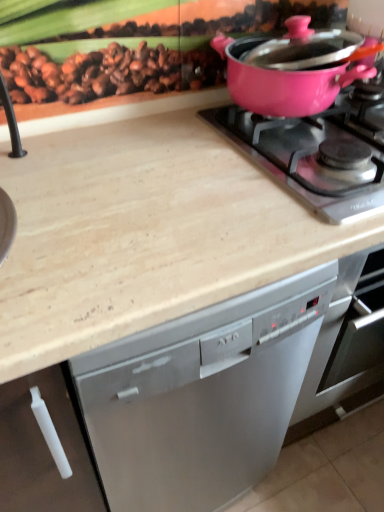
Question: Is pink glossy pot at upper right wider than beige marble countertop at upper center?

Choices:
 (A) yes
 (B) no

Answer: (B)

Question: Is pink glossy pot at upper right touching beige marble countertop at upper center?

Choices:
 (A) no
 (B) yes

Answer: (A)

Question: Does pink glossy pot at upper right lie in front of beige marble countertop at upper center?

Choices:
 (A) yes
 (B) no

Answer: (B)

Question: Considering the relative positions of pink glossy pot at upper right and beige marble countertop at upper center in the image provided, is pink glossy pot at upper right to the left of beige marble countertop at upper center from the viewer's perspective?

Choices:
 (A) yes
 (B) no

Answer: (B)

Question: Is pink glossy pot at upper right aimed at beige marble countertop at upper center?

Choices:
 (A) yes
 (B) no

Answer: (B)

Question: Does point (266, 82) appear closer or farther from the camera than point (284, 138)?

Choices:
 (A) closer
 (B) farther

Answer: (B)

Question: In terms of height, does pink glossy pot at upper right look taller or shorter compared to pink glossy pot at upper right?

Choices:
 (A) tall
 (B) short

Answer: (A)

Question: From the image's perspective, relative to pink glossy pot at upper right, is pink glossy pot at upper right above or below?

Choices:
 (A) below
 (B) above

Answer: (B)

Question: Would you say pink glossy pot at upper right is inside or outside pink glossy pot at upper right?

Choices:
 (A) inside
 (B) outside

Answer: (B)

Question: In the image, is beige marble countertop at upper center on the left side or the right side of pink glossy pot at upper right?

Choices:
 (A) left
 (B) right

Answer: (A)

Question: From a real-world perspective, is beige marble countertop at upper center above or below pink glossy pot at upper right?

Choices:
 (A) below
 (B) above

Answer: (A)

Question: Considering their positions, is beige marble countertop at upper center located in front of or behind pink glossy pot at upper right?

Choices:
 (A) front
 (B) behind

Answer: (A)

Question: From the image's perspective, is beige marble countertop at upper center above or below pink glossy pot at upper right?

Choices:
 (A) above
 (B) below

Answer: (B)

Question: Is pink glossy pot at upper right in front of or behind pink glossy pot at upper right in the image?

Choices:
 (A) behind
 (B) front

Answer: (B)

Question: Is pink glossy pot at upper right spatially inside pink glossy pot at upper right, or outside of it?

Choices:
 (A) inside
 (B) outside

Answer: (B)